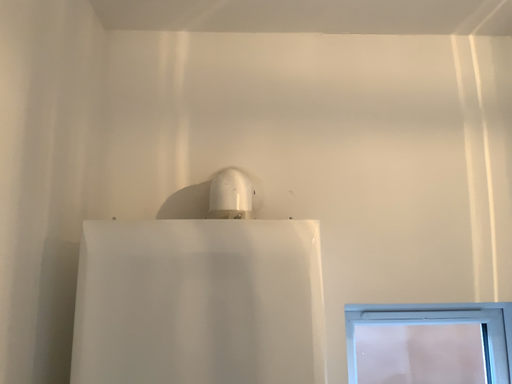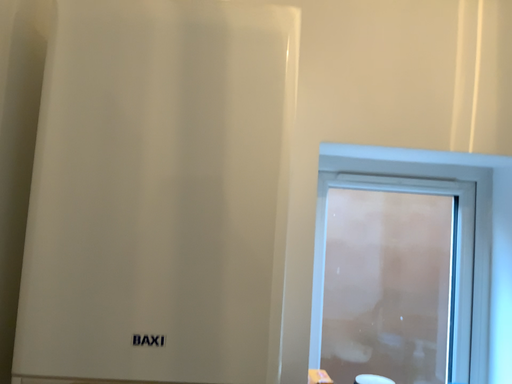
Question: How did the camera likely rotate when shooting the video?

Choices:
 (A) rotated downward
 (B) rotated upward

Answer: (A)